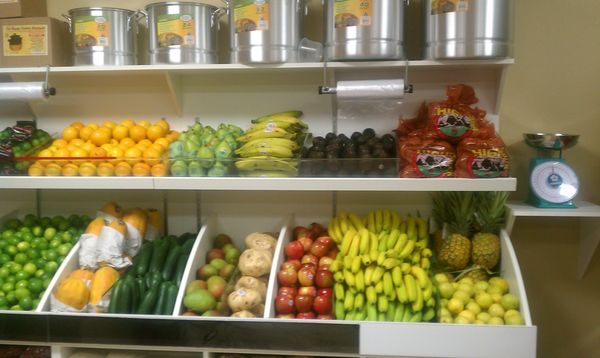
Locate an element on the screen. The width and height of the screenshot is (600, 358). stock pots is located at coordinates (114, 26), (180, 36), (267, 33), (357, 36), (467, 33).